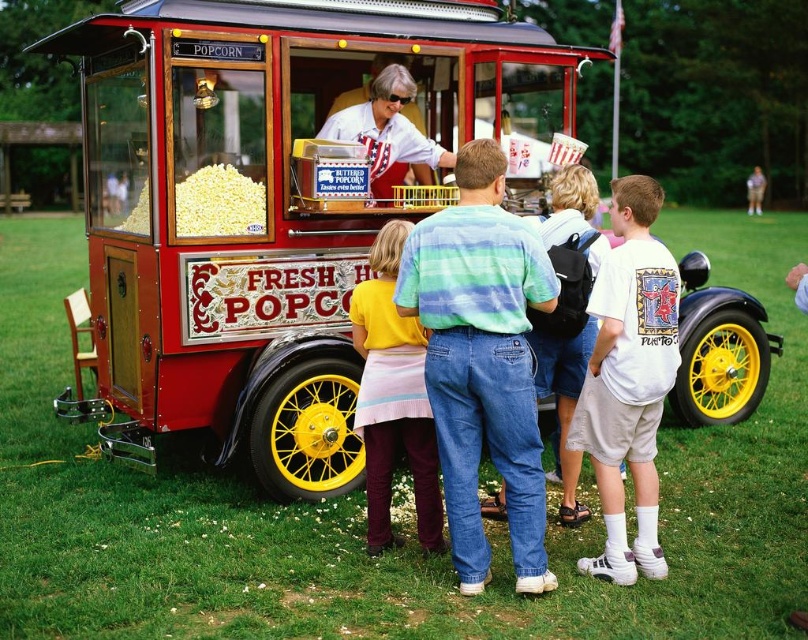
You are a customer standing at the entrance of the park. You see the point marked at coordinates (268,204). What object is this point located on?

The point marked at coordinates (268,204) is located on the red polished wood popcorn cart at center.